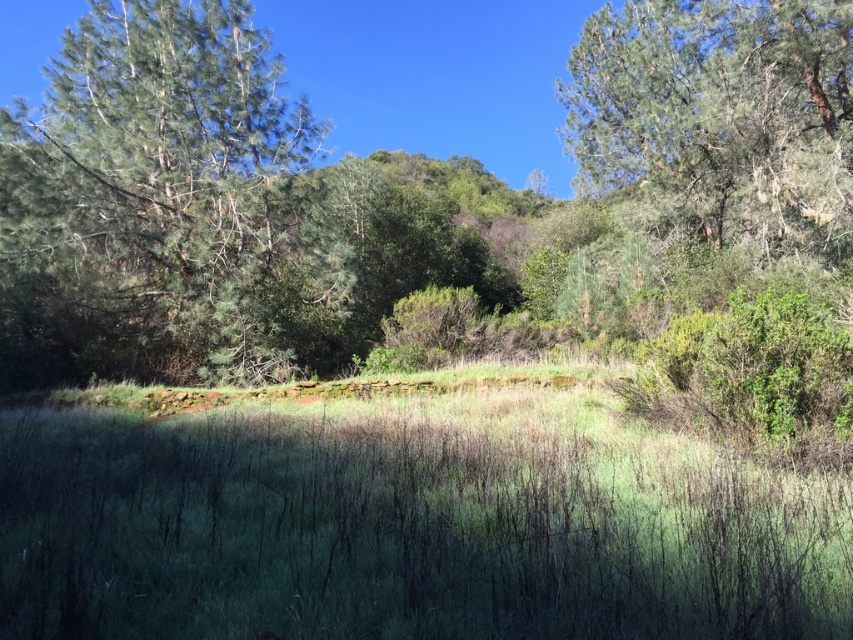
Is green textured tree at left further to camera compared to green textured tree at upper right?

No, it is in front of green textured tree at upper right.

Measure the distance between point (111, 364) and camera.

Point (111, 364) is 16.83 meters away from camera.

Locate an element on the screen. green textured tree at left is located at coordinates click(148, 195).

Does green grassy at center have a lesser height compared to green textured tree at left?

Yes, green grassy at center is shorter than green textured tree at left.

Can you confirm if green grassy at center is positioned below green textured tree at left?

Correct, green grassy at center is located below green textured tree at left.

Is point (842, 480) behind point (300, 156)?

No, it is in front of (300, 156).

The image size is (853, 640). What are the coordinates of `green grassy at center` in the screenshot? It's located at (408, 525).

Between point (422, 468) and point (850, 19), which one is positioned in front?

Point (422, 468)

Is point (283, 460) positioned after point (647, 104)?

No, (283, 460) is closer to viewer.

Which is in front, point (462, 536) or point (572, 54)?

Point (462, 536)

I want to click on green grassy at center, so click(x=408, y=525).